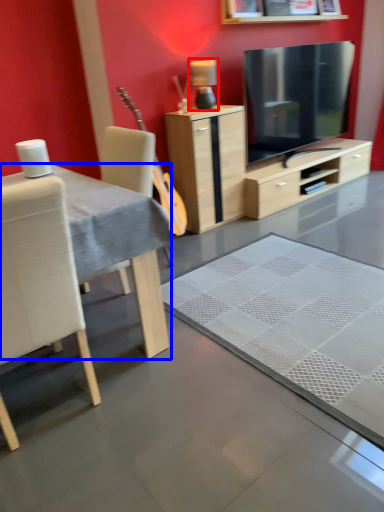
Question: Among these objects, which one is farthest to the camera, lamp (highlighted by a red box) or desk (highlighted by a blue box)?

Choices:
 (A) lamp
 (B) desk

Answer: (A)